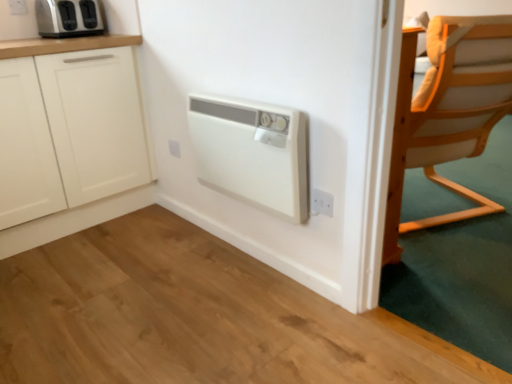
Question: Is white plastic electric outlet at center, which is the second electric outlet from back to front, at the back of light wood chair at right?

Choices:
 (A) no
 (B) yes

Answer: (A)

Question: Is light wood chair at right next to white plastic electric outlet at center, which ranks as the 2th electric outlet in top-to-bottom order?

Choices:
 (A) yes
 (B) no

Answer: (B)

Question: Is light wood chair at right far away from white plastic electric outlet at center, the second electric outlet in the bottom-to-top sequence?

Choices:
 (A) no
 (B) yes

Answer: (B)

Question: From the image's perspective, is light wood chair at right over white plastic electric outlet at center, which is the second electric outlet from back to front?

Choices:
 (A) yes
 (B) no

Answer: (A)

Question: Is light wood chair at right completely or partially outside of white plastic electric outlet at center, arranged as the 2th electric outlet when viewed from the left?

Choices:
 (A) no
 (B) yes

Answer: (B)

Question: Is light wood chair at right further to camera compared to white plastic electric outlet at center, which is the 2th electric outlet in right-to-left order?

Choices:
 (A) yes
 (B) no

Answer: (B)

Question: Considering the relative sizes of light wood chair at right and white plastic electric outlet at upper left, which ranks as the 1th electric outlet in back-to-front order, in the image provided, is light wood chair at right taller than white plastic electric outlet at upper left, which ranks as the 1th electric outlet in back-to-front order,?

Choices:
 (A) no
 (B) yes

Answer: (B)

Question: Is light wood chair at right smaller than white plastic electric outlet at upper left, placed as the 3th electric outlet when sorted from front to back?

Choices:
 (A) yes
 (B) no

Answer: (B)

Question: Considering the relative sizes of light wood chair at right and white plastic electric outlet at upper left, which ranks as the 1th electric outlet in left-to-right order, in the image provided, is light wood chair at right shorter than white plastic electric outlet at upper left, which ranks as the 1th electric outlet in left-to-right order,?

Choices:
 (A) no
 (B) yes

Answer: (A)

Question: Is light wood chair at right behind white plastic electric outlet at upper left, which ranks as the 1th electric outlet in left-to-right order?

Choices:
 (A) yes
 (B) no

Answer: (B)

Question: Could you tell me if light wood chair at right is facing white plastic electric outlet at upper left, acting as the 1th electric outlet starting from the top?

Choices:
 (A) yes
 (B) no

Answer: (B)

Question: Is light wood chair at right outside of white plastic electric outlet at upper left, placed as the 3th electric outlet when sorted from front to back?

Choices:
 (A) yes
 (B) no

Answer: (A)

Question: From the image's perspective, is white plastic electric outlet at center, which is the 2th electric outlet in right-to-left order, over white matte cabinet at left?

Choices:
 (A) no
 (B) yes

Answer: (A)